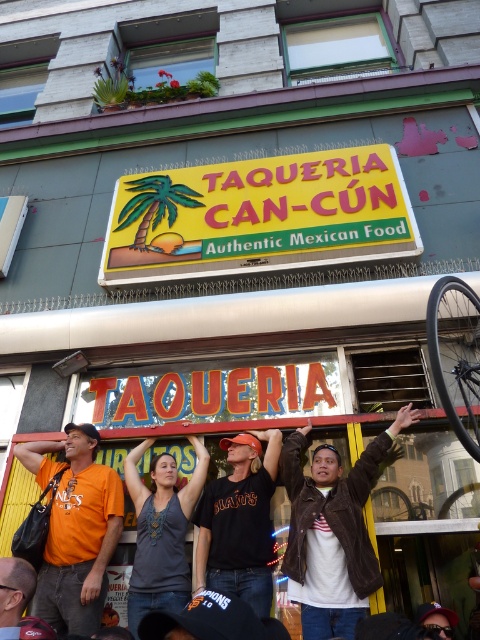
Does yellowsignboard at center have a greater width compared to orange t-shirt at center?

Yes, yellowsignboard at center is wider than orange t-shirt at center.

Can you confirm if yellowsignboard at center is positioned to the right of orange t-shirt at center?

Indeed, yellowsignboard at center is positioned on the right side of orange t-shirt at center.

Does point (309, 172) come farther from viewer compared to point (13, 564)?

Yes, it is behind point (13, 564).

I want to click on yellowsignboard at center, so click(x=259, y=216).

Which of these two, black matte bicycle wheel at right or orange t-shirt at center, stands shorter?

Standing shorter between the two is orange t-shirt at center.

Does black matte bicycle wheel at right have a larger size compared to orange t-shirt at center?

Correct, black matte bicycle wheel at right is larger in size than orange t-shirt at center.

Which is in front, point (462, 332) or point (7, 637)?

Point (7, 637)

Locate an element on the screen. black matte bicycle wheel at right is located at coordinates (456, 355).

Based on the photo, can you confirm if black cotton shirt at center is thinner than gray cotton tank top at center?

Correct, black cotton shirt at center's width is less than gray cotton tank top at center's.

This screenshot has height=640, width=480. What do you see at coordinates (240, 522) in the screenshot?
I see `black cotton shirt at center` at bounding box center [240, 522].

Between point (237, 524) and point (187, 518), which one is positioned in front?

Positioned in front is point (237, 524).

Identify the location of black cotton shirt at center. The image size is (480, 640). (240, 522).